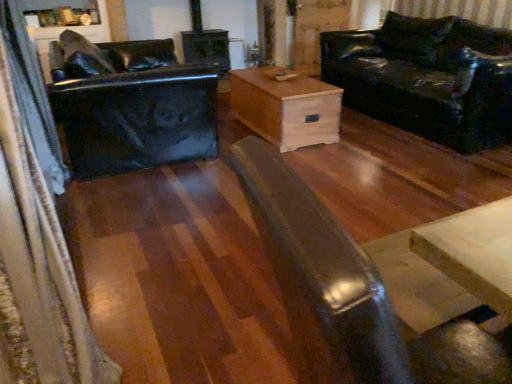
Where is `vacant space in front of natural wood chest at center`? The image size is (512, 384). vacant space in front of natural wood chest at center is located at coordinates (308, 167).